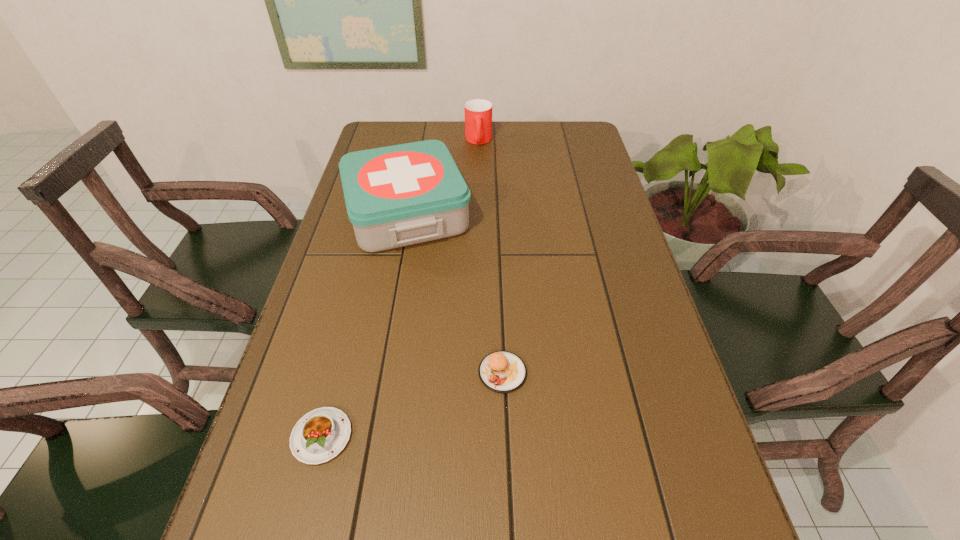
Where is `object that is at the far edge`? This screenshot has width=960, height=540. object that is at the far edge is located at coordinates (478, 113).

Where is `the first-aid kit that is at the left edge`? The image size is (960, 540). the first-aid kit that is at the left edge is located at coordinates click(400, 195).

I want to click on pudding at the left edge, so click(320, 435).

The width and height of the screenshot is (960, 540). In the image, there is a desktop. Find the location of `vacant space at the far edge`. vacant space at the far edge is located at coordinates (505, 151).

Find the location of `free space at the left edge of the desktop`. free space at the left edge of the desktop is located at coordinates (342, 207).

At what (x,y) coordinates should I click in order to perform the action: click on vacant space at the right edge. Please return your answer as a coordinate pair (x, y). This screenshot has height=540, width=960. Looking at the image, I should click on (732, 527).

Locate an element on the screen. This screenshot has width=960, height=540. free region at the far left corner is located at coordinates (x=383, y=147).

The width and height of the screenshot is (960, 540). In the image, there is a desktop. Identify the location of vacant region at the far right corner. (578, 124).

The height and width of the screenshot is (540, 960). I want to click on free area in between the third nearest object and the nearest object, so click(365, 325).

Locate an element on the screen. empty location between the third nearest object and the nearest object is located at coordinates (365, 325).